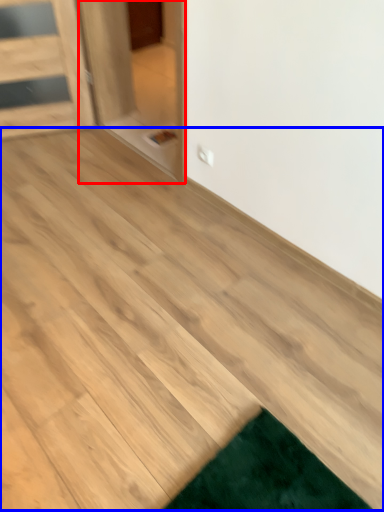
Question: Which of the following is the farthest to the observer, glass door (highlighted by a red box) or plywood (highlighted by a blue box)?

Choices:
 (A) glass door
 (B) plywood

Answer: (A)